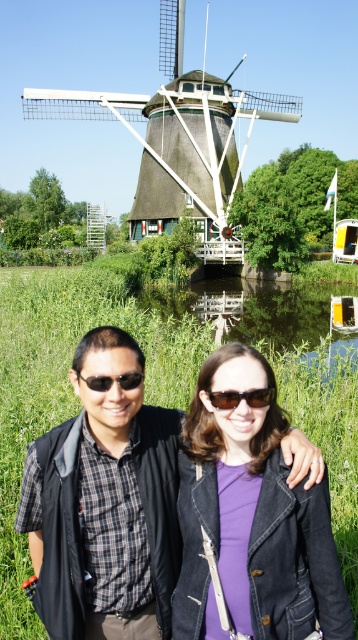
Which is more to the right, sunglasses at center or black plastic sunglasses at center?

sunglasses at center

Between sunglasses at center and black plastic sunglasses at center, which one is positioned lower?

Result: sunglasses at center is lower down.

Does point (234, 403) come in front of point (107, 385)?

Yes.

Where is `sunglasses at center`? The height and width of the screenshot is (640, 358). sunglasses at center is located at coordinates click(x=242, y=397).

Who is taller, purple denim jacket at center or matte black vest at center?

matte black vest at center

Is point (248, 349) positioned after point (118, 612)?

Yes, point (248, 349) is farther from viewer.

Between point (298, 636) and point (117, 412), which one is positioned behind?

Point (117, 412)

This screenshot has width=358, height=640. What are the coordinates of `purple denim jacket at center` in the screenshot? It's located at (253, 529).

Is point (83, 454) less distant than point (258, 404)?

That is False.

Is matte black vest at center above sunglasses at center?

Actually, matte black vest at center is below sunglasses at center.

This screenshot has width=358, height=640. Identify the location of matte black vest at center. (117, 493).